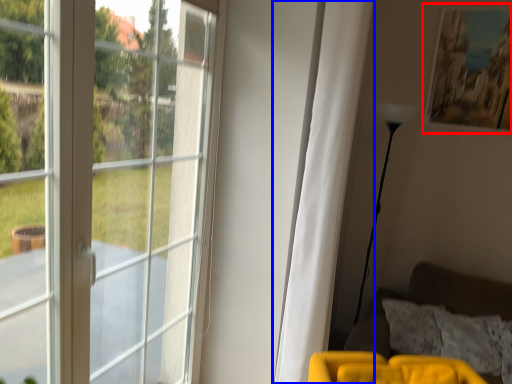
Question: Among these objects, which one is farthest to the camera, picture frame (highlighted by a red box) or curtain (highlighted by a blue box)?

Choices:
 (A) picture frame
 (B) curtain

Answer: (A)